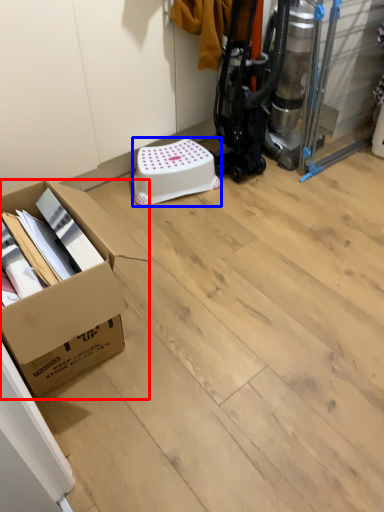
Question: Which of the following is the farthest to the observer, box (highlighted by a red box) or stool (highlighted by a blue box)?

Choices:
 (A) box
 (B) stool

Answer: (B)